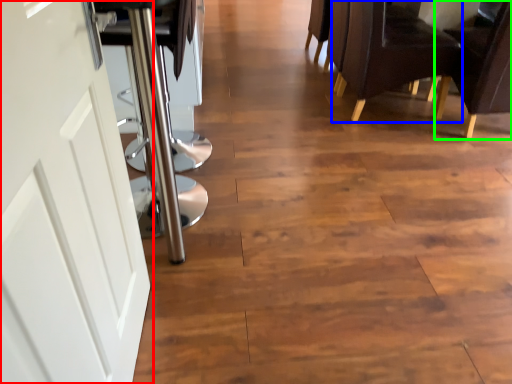
Question: Estimate the real-world distances between objects in this image. Which object is farther from door (highlighted by a red box), chair (highlighted by a blue box) or chair (highlighted by a green box)?

Choices:
 (A) chair
 (B) chair

Answer: (B)